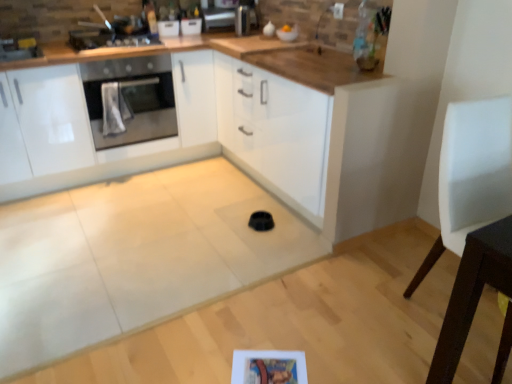
Question: From a real-world perspective, is stainless steel oven at left positioned above or below white leather chair at right?

Choices:
 (A) above
 (B) below

Answer: (A)

Question: Does point (96, 84) appear closer or farther from the camera than point (453, 127)?

Choices:
 (A) farther
 (B) closer

Answer: (A)

Question: Based on their relative distances, which object is nearer to the white glossy cabinets at center?

Choices:
 (A) white leather chair at right
 (B) stainless steel oven at left
 (C) satin silver toaster at upper center
 (D) metallic stainless steel oven at upper left

Answer: (B)

Question: Which object is positioned closest to the white leather chair at right?

Choices:
 (A) white glossy cabinets at center
 (B) stainless steel oven at left
 (C) metallic stainless steel oven at upper left
 (D) satin silver toaster at upper center

Answer: (D)